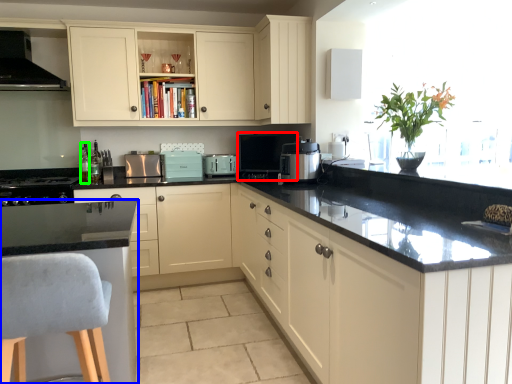
Question: Which object is the closest to the coffee machine (highlighted by a red box)? Choose among these: countertop (highlighted by a blue box) or bottle (highlighted by a green box).

Choices:
 (A) countertop
 (B) bottle

Answer: (A)